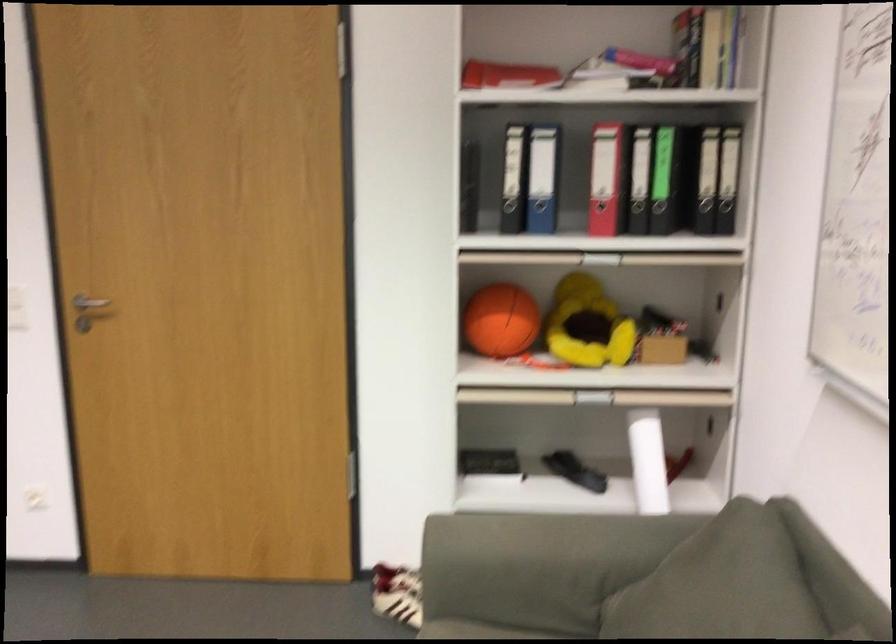
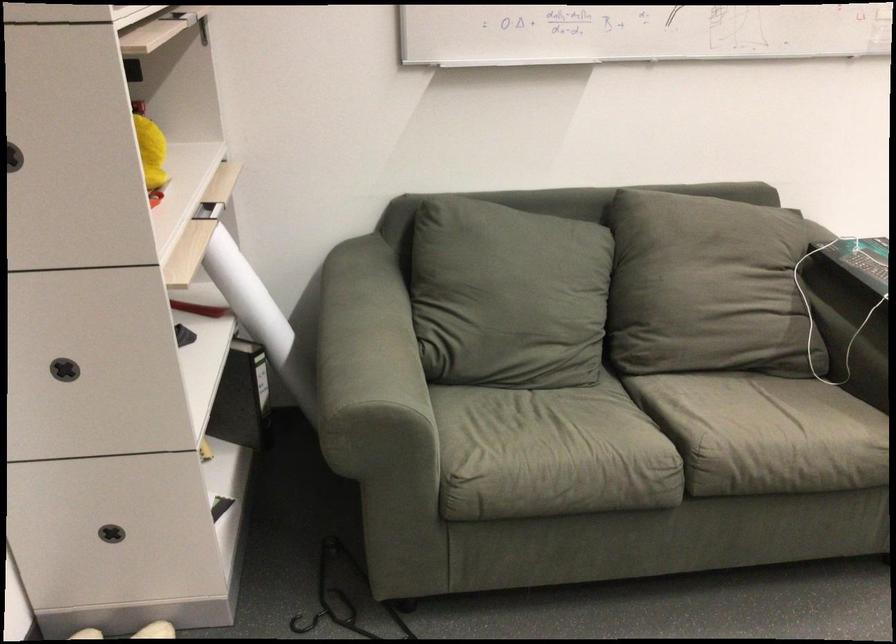
Find the pixel in the second image that matches (x=616, y=341) in the first image.

(151, 152)